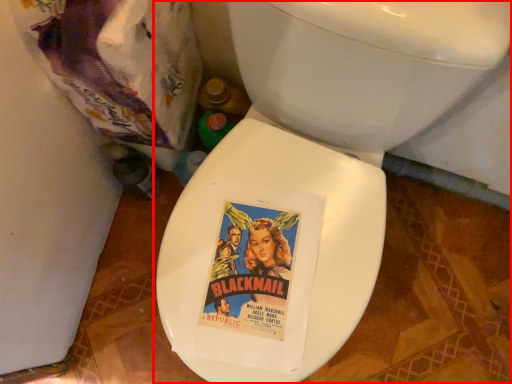
Question: From the image's perspective, where is toilet (annotated by the red box) located in relation to garbage in the image?

Choices:
 (A) above
 (B) below

Answer: (B)